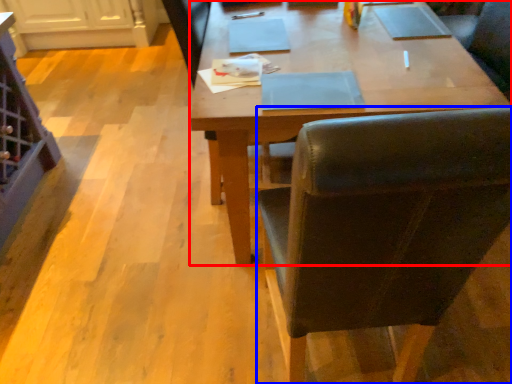
Question: Which of the following is the closest to the observer, desk (highlighted by a red box) or chair (highlighted by a blue box)?

Choices:
 (A) desk
 (B) chair

Answer: (B)